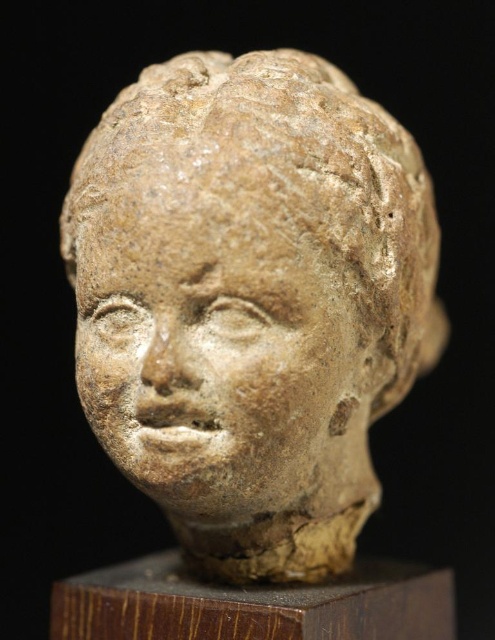
Question: Does brown clay head at center appear over earthy clay face at center?

Choices:
 (A) yes
 (B) no

Answer: (A)

Question: Considering the relative positions of brown clay head at center and earthy clay face at center in the image provided, where is brown clay head at center located with respect to earthy clay face at center?

Choices:
 (A) below
 (B) above

Answer: (B)

Question: Among these points, which one is farthest from the camera?

Choices:
 (A) (316, 253)
 (B) (144, 276)

Answer: (A)

Question: Where is brown clay head at center located in relation to earthy clay face at center in the image?

Choices:
 (A) right
 (B) left

Answer: (A)